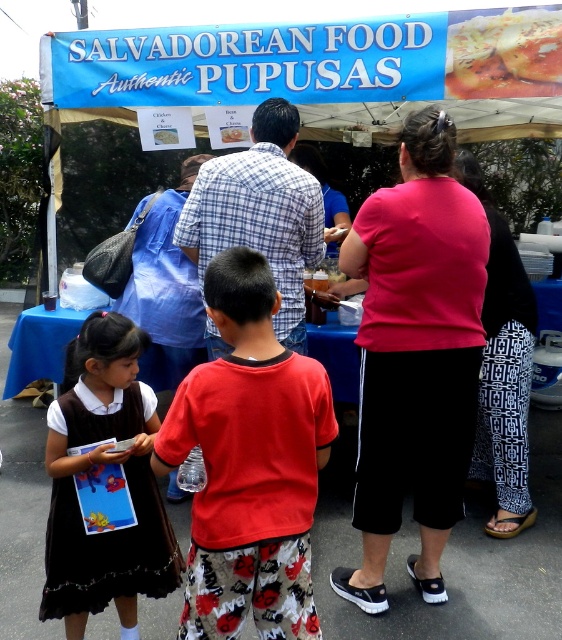
Question: Which point is farther to the camera?

Choices:
 (A) (465, 458)
 (B) (106, 324)
 (C) (219, 225)

Answer: (C)

Question: Which of these objects is positioned farthest from the red cotton shirt at center?

Choices:
 (A) pink fabric shirt at center
 (B) golden crispy pupusas at center

Answer: (B)

Question: Can you confirm if pink fabric shirt at center is thinner than red cotton shirt at center?

Choices:
 (A) yes
 (B) no

Answer: (B)

Question: Is pink fabric shirt at center above plaid shirt at center?

Choices:
 (A) no
 (B) yes

Answer: (A)

Question: Which object appears closest to the camera in this image?

Choices:
 (A) pink fabric shirt at center
 (B) golden crispy pupusas at center
 (C) red cotton shirt at center
 (D) matte black dress at lower left

Answer: (C)

Question: Can you confirm if pink fabric shirt at center is positioned below golden crispy pupusas at center?

Choices:
 (A) yes
 (B) no

Answer: (A)